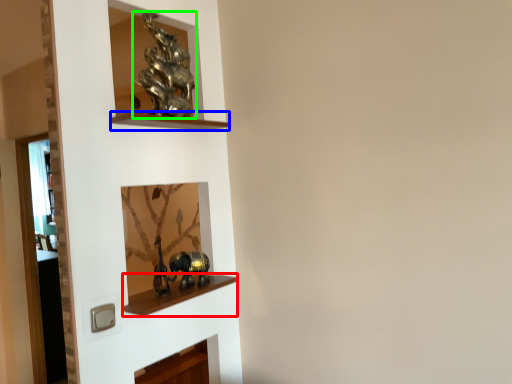
Question: Which is nearer to the cabinet (highlighted by a red box)? cabinet (highlighted by a blue box) or art (highlighted by a green box).

Choices:
 (A) cabinet
 (B) art

Answer: (A)